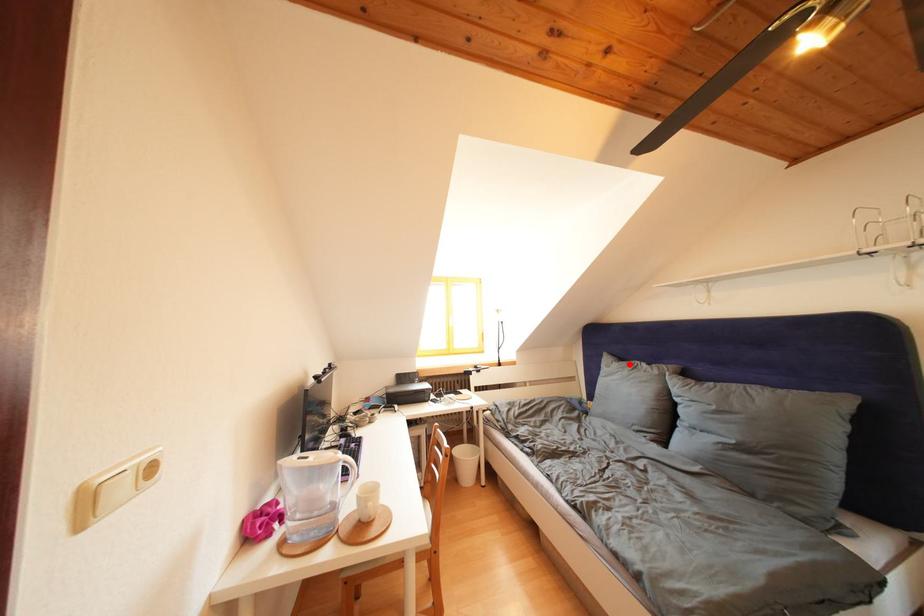
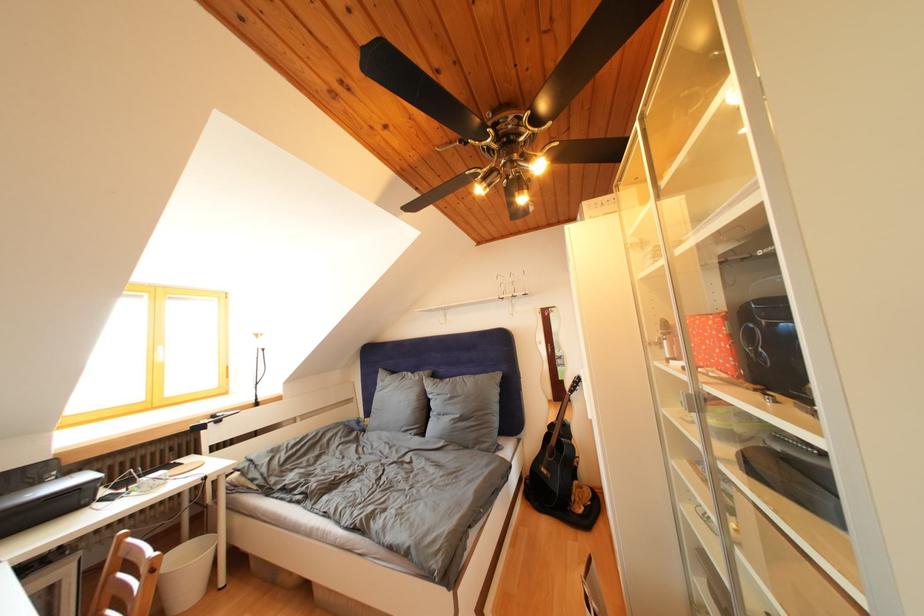
The point at the highlighted location is marked in the first image. Where is the corresponding point in the second image?

(400, 378)